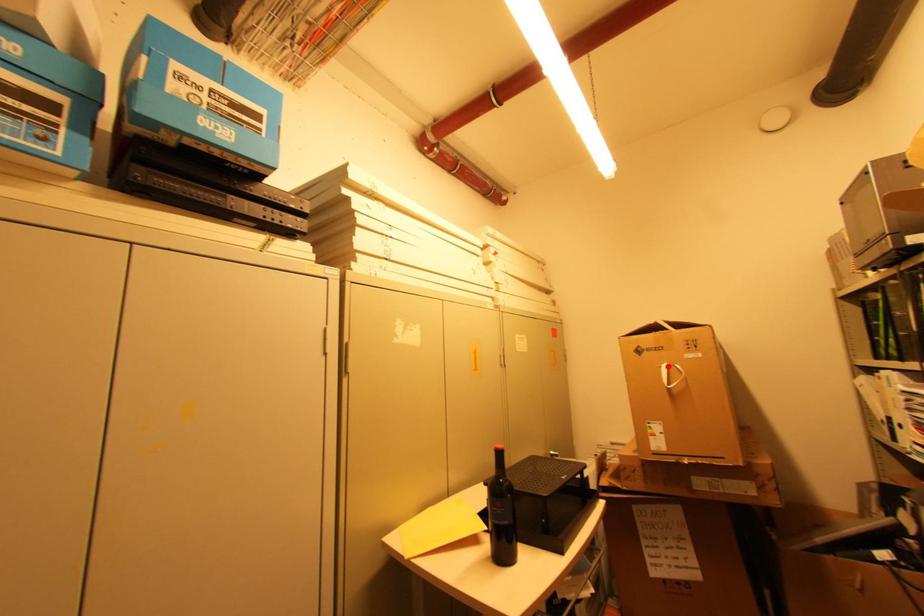
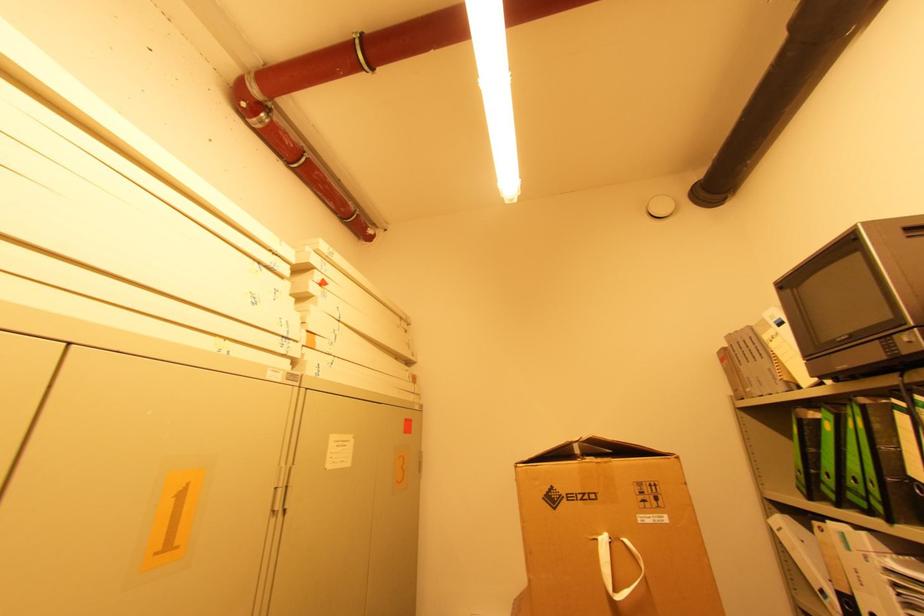
Question: I am providing you with two images of the same scene from different viewpoints. A red point is marked on the first image. At the location where the point appears in image 1, is it still visible in image 2?

Choices:
 (A) Yes
 (B) No

Answer: (A)